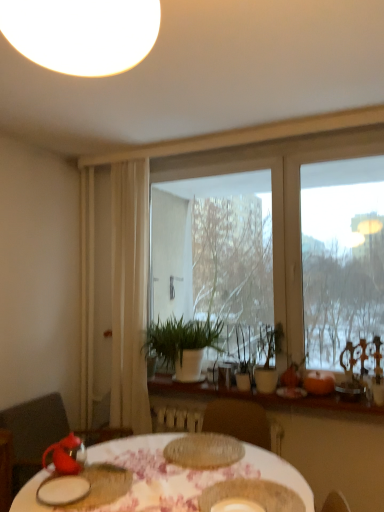
Question: Would you say wooden at center is inside or outside white ceramic plate at lower left, which appears as the 9th tableware when viewed from the right?

Choices:
 (A) inside
 (B) outside

Answer: (B)

Question: In terms of width, does wooden at center look wider or thinner when compared to white ceramic plate at lower left, which appears as the 9th tableware when viewed from the right?

Choices:
 (A) wide
 (B) thin

Answer: (A)

Question: Which object is positioned farthest from the matte red teapot at lower left, positioned as the first tableware in left-to-right order?

Choices:
 (A) matte glass vase at center, placed as the fifth tableware when sorted from right to left
 (B) matte red teapot at lower left, the eighth tableware viewed from the right
 (C) white matte plant at center
 (D) white sheer curtain at left
 (E) orange matte pumpkin at right, the 9th tableware from the left

Answer: (E)

Question: Which object is positioned closest to the white ceramic plate at lower left, which ranks as the second tableware in left-to-right order?

Choices:
 (A) matte ceramic bowl at center, which is the 7th tableware from left to right
 (B) matte red teapot at lower left, the eighth tableware viewed from the right
 (C) matte brown plate at center, which appears as the 6th tableware when viewed from the right
 (D) translucent glass plate at center, the 7th tableware in the right-to-left sequence
 (E) metallic silver tray at right, which is counted as the 10th tableware, starting from the left

Answer: (B)